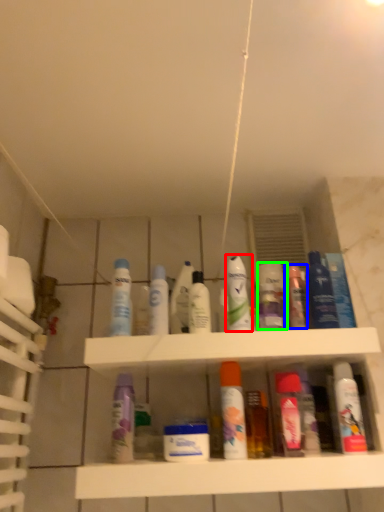
Question: Estimate the real-world distances between objects in this image. Which object is farther from mouthwash (highlighted by a red box), toiletry (highlighted by a blue box) or toiletry (highlighted by a green box)?

Choices:
 (A) toiletry
 (B) toiletry

Answer: (A)